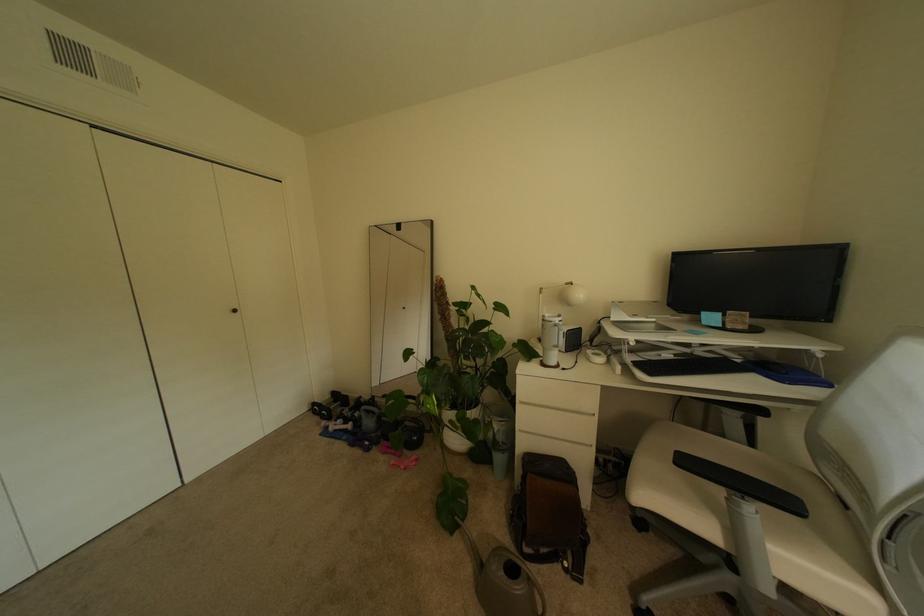
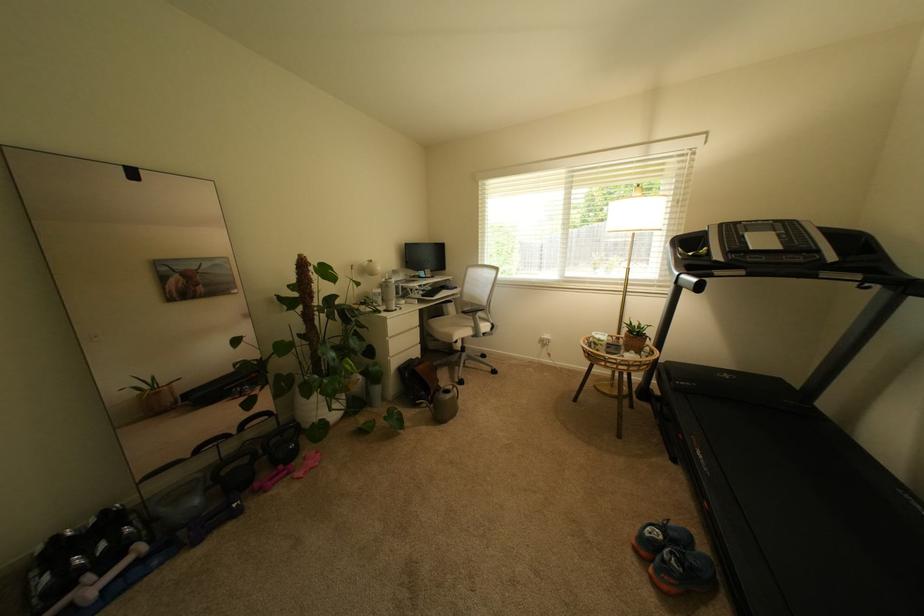
Where in the second image is the point corresponding to (x=351, y=424) from the first image?

(111, 573)